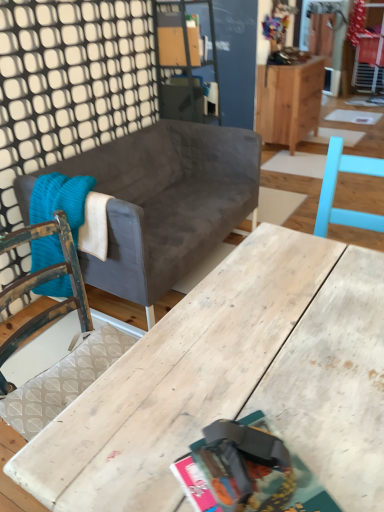
Question: From the image's perspective, is knitted wool blanket at left beneath velvet gray couch at center?

Choices:
 (A) no
 (B) yes

Answer: (B)

Question: Are knitted wool blanket at left and velvet gray couch at center making contact?

Choices:
 (A) yes
 (B) no

Answer: (B)

Question: From a real-world perspective, is knitted wool blanket at left physically below velvet gray couch at center?

Choices:
 (A) no
 (B) yes

Answer: (A)

Question: From a real-world perspective, is knitted wool blanket at left positioned over velvet gray couch at center based on gravity?

Choices:
 (A) yes
 (B) no

Answer: (A)

Question: Is knitted wool blanket at left closer to the viewer compared to velvet gray couch at center?

Choices:
 (A) yes
 (B) no

Answer: (B)

Question: Can you confirm if knitted wool blanket at left is taller than velvet gray couch at center?

Choices:
 (A) no
 (B) yes

Answer: (A)

Question: From the image's perspective, would you say velvet gray couch at center is shown under matte paper magazine at center?

Choices:
 (A) yes
 (B) no

Answer: (B)

Question: Can we say velvet gray couch at center lies outside matte paper magazine at center?

Choices:
 (A) no
 (B) yes

Answer: (B)

Question: Is velvet gray couch at center positioned behind matte paper magazine at center?

Choices:
 (A) yes
 (B) no

Answer: (A)

Question: Is velvet gray couch at center wider than matte paper magazine at center?

Choices:
 (A) no
 (B) yes

Answer: (B)

Question: Is the depth of velvet gray couch at center less than that of matte paper magazine at center?

Choices:
 (A) yes
 (B) no

Answer: (B)

Question: Does velvet gray couch at center have a lesser height compared to matte paper magazine at center?

Choices:
 (A) yes
 (B) no

Answer: (B)

Question: Does wooden cabinet at upper right have a larger size compared to velvet gray couch at center?

Choices:
 (A) yes
 (B) no

Answer: (B)